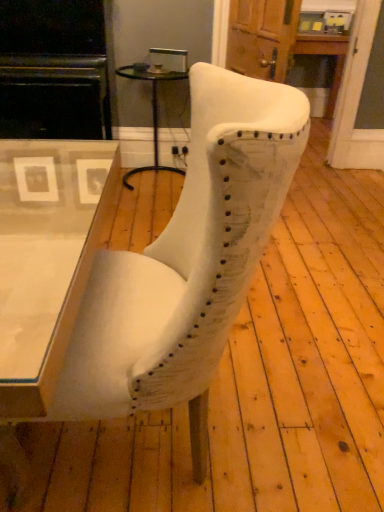
Question: Is matte black entertainment center at left further to camera compared to black glass side table at center?

Choices:
 (A) no
 (B) yes

Answer: (A)

Question: From a real-world perspective, does matte black entertainment center at left sit lower than black glass side table at center?

Choices:
 (A) no
 (B) yes

Answer: (A)

Question: Is matte black entertainment center at left positioned in front of black glass side table at center?

Choices:
 (A) yes
 (B) no

Answer: (A)

Question: Is matte black entertainment center at left smaller than black glass side table at center?

Choices:
 (A) yes
 (B) no

Answer: (B)

Question: Considering the relative positions of matte black entertainment center at left and black glass side table at center in the image provided, is matte black entertainment center at left to the left of black glass side table at center from the viewer's perspective?

Choices:
 (A) yes
 (B) no

Answer: (A)

Question: Is black glass side table at center surrounded by matte black entertainment center at left?

Choices:
 (A) no
 (B) yes

Answer: (A)

Question: From the image's perspective, is white fabric chair at center under black glass side table at center?

Choices:
 (A) no
 (B) yes

Answer: (B)

Question: Is white fabric chair at center in front of black glass side table at center?

Choices:
 (A) yes
 (B) no

Answer: (A)

Question: Is white fabric chair at center next to black glass side table at center?

Choices:
 (A) no
 (B) yes

Answer: (A)

Question: Considering the relative sizes of white fabric chair at center and black glass side table at center in the image provided, is white fabric chair at center thinner than black glass side table at center?

Choices:
 (A) yes
 (B) no

Answer: (B)

Question: Is white fabric chair at center not inside black glass side table at center?

Choices:
 (A) yes
 (B) no

Answer: (A)

Question: Considering the relative sizes of white fabric chair at center and black glass side table at center in the image provided, is white fabric chair at center shorter than black glass side table at center?

Choices:
 (A) yes
 (B) no

Answer: (B)

Question: Is matte black entertainment center at left completely or partially inside white fabric chair at center?

Choices:
 (A) yes
 (B) no

Answer: (B)